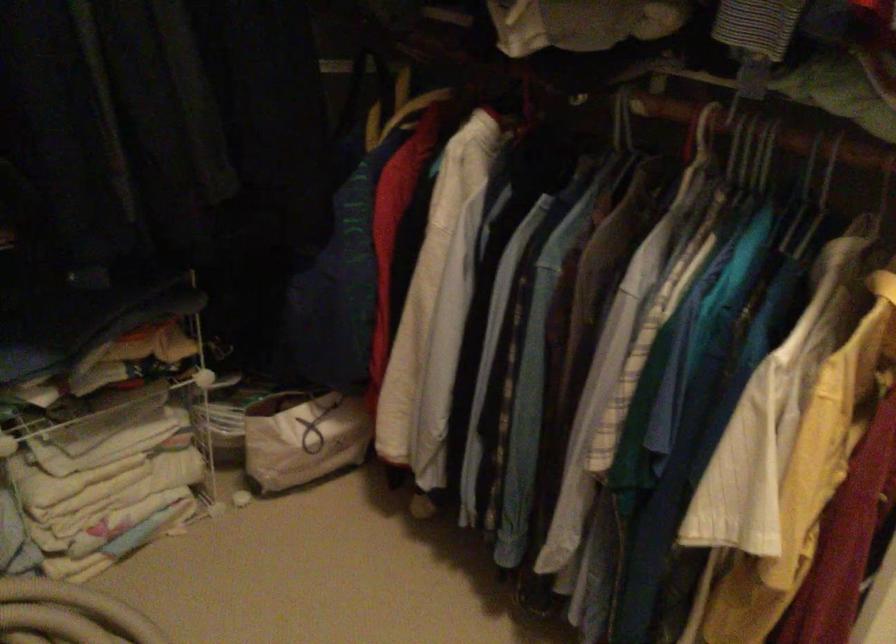
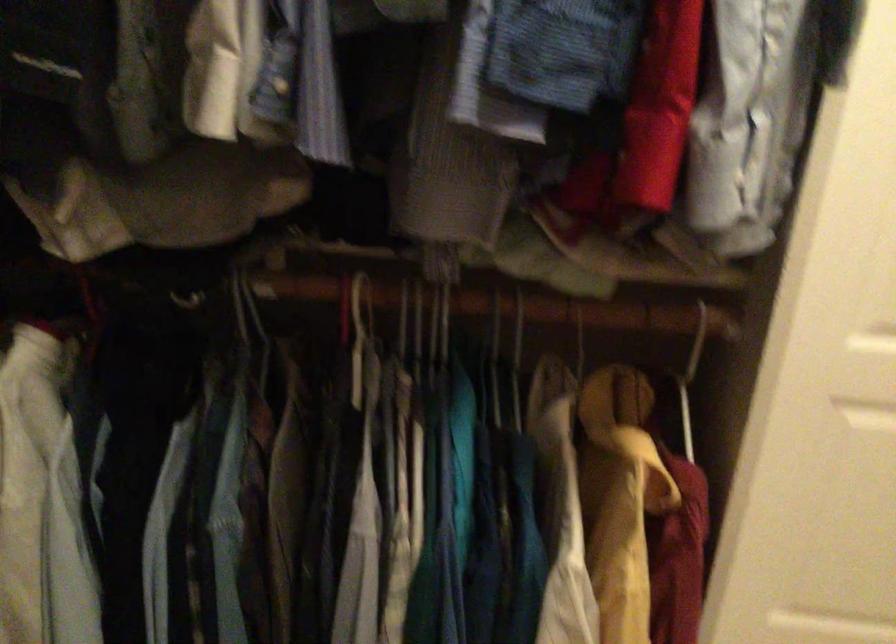
The point at (829, 172) is marked in the first image. Where is the corresponding point in the second image?

(457, 299)